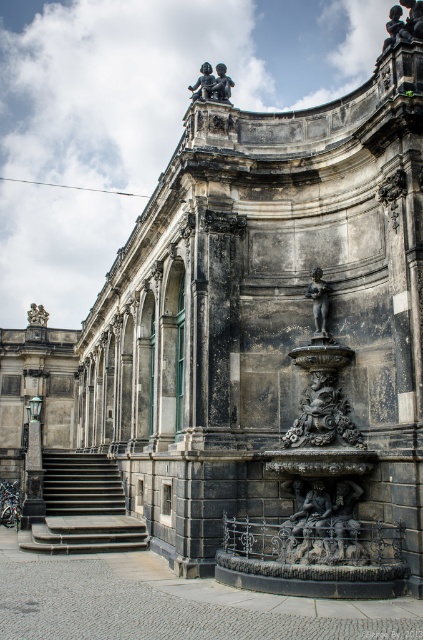
Does dark gray stone fountain at center have a greater width compared to bronze statue at upper left?

Yes, dark gray stone fountain at center is wider than bronze statue at upper left.

Does dark gray stone fountain at center have a greater height compared to bronze statue at upper left?

Yes, dark gray stone fountain at center is taller than bronze statue at upper left.

Does point (337, 422) lie behind point (30, 308)?

No.

Identify the location of dark gray stone fountain at center. (318, 502).

Measure the distance between point [65,522] and camera.

A distance of 58.26 meters exists between point [65,522] and camera.

Who is more distant from viewer, (60, 477) or (390, 10)?

Positioned behind is point (60, 477).

The width and height of the screenshot is (423, 640). In order to click on dark gray stone stairs at lower left in this screenshot , I will do `click(84, 508)`.

Which is in front, point (398, 32) or point (43, 317)?

Point (398, 32) is more forward.

Can you confirm if polished bronze statue at upper center is taller than bronze statue at upper left?

Yes.

Which is in front, point (392, 44) or point (29, 317)?

Positioned in front is point (392, 44).

You are a GUI agent. You are given a task and a screenshot of the screen. Output one action in this format:
    pyautogui.click(x=<x>, y=<y>)
    Task: Click on the polished bronze statue at upper center
    
    Given the screenshot: What is the action you would take?
    pyautogui.click(x=403, y=22)